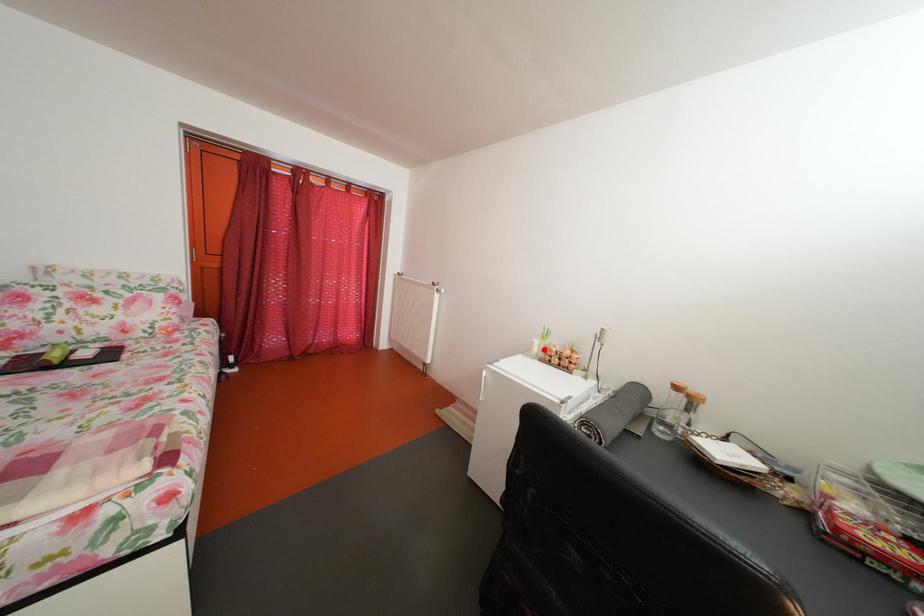
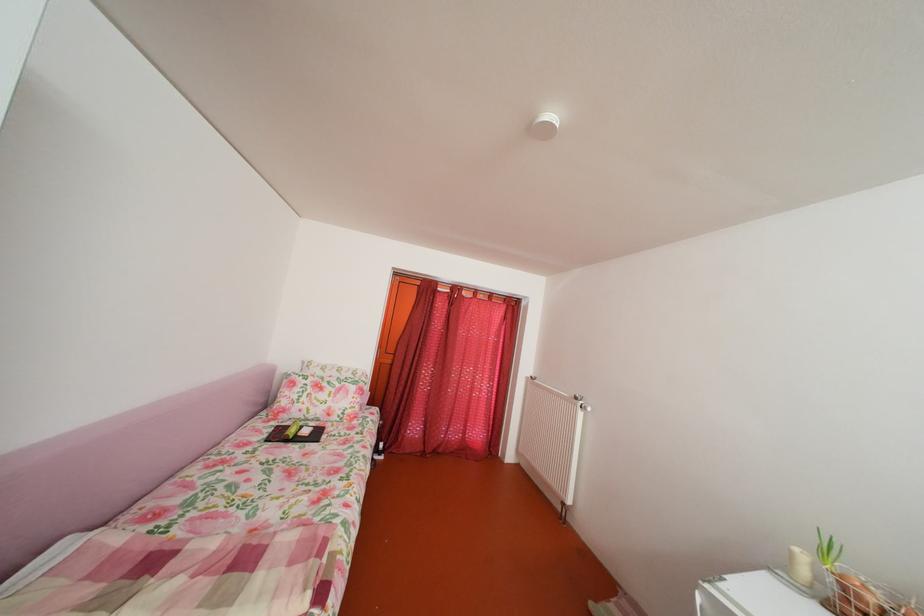
The point at the highlighted location is marked in the first image. Where is the corresponding point in the second image?

(803, 561)